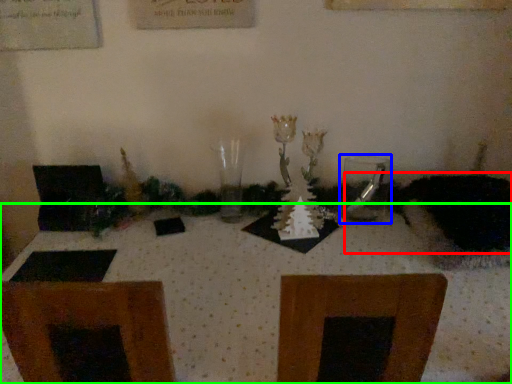
Question: Which object is positioned farthest from animal (highlighted by a red box)? Select from tableware (highlighted by a blue box) and table (highlighted by a green box).

Choices:
 (A) tableware
 (B) table

Answer: (B)